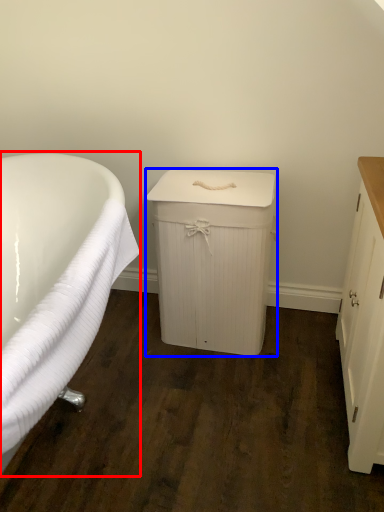
Question: Which of the following is the closest to the observer, bathtub (highlighted by a red box) or cabinetry (highlighted by a blue box)?

Choices:
 (A) bathtub
 (B) cabinetry

Answer: (A)